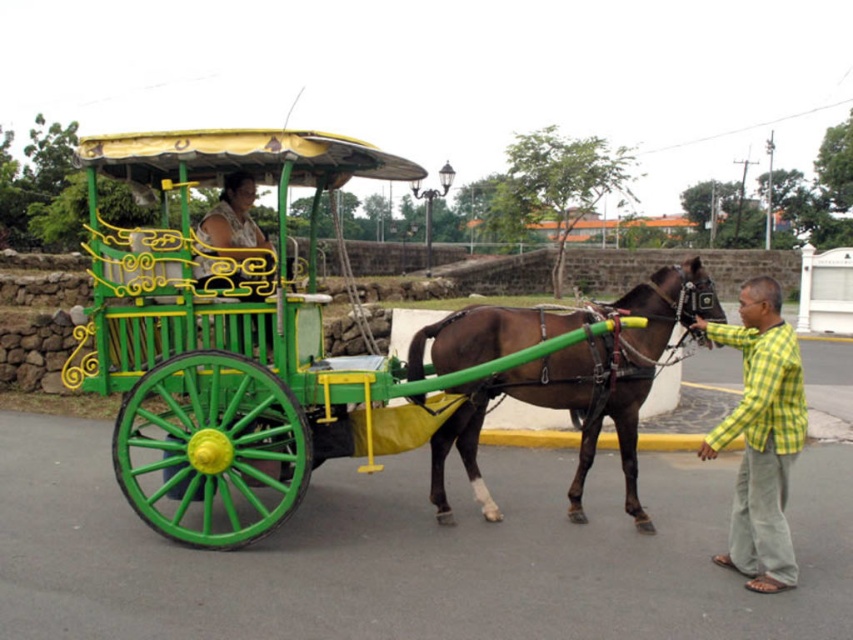
Question: Which point appears farthest from the camera in this image?

Choices:
 (A) (575, 372)
 (B) (596, 417)

Answer: (B)

Question: Among these objects, which one is farthest from the camera?

Choices:
 (A) green polished wood horse cart at center
 (B) brown glossy horse at center
 (C) yellow-green checkered shirt at lower right

Answer: (B)

Question: Is brown glossy horse at center below yellow-green checkered shirt at lower right?

Choices:
 (A) yes
 (B) no

Answer: (B)

Question: Which of the following is the farthest from the observer?

Choices:
 (A) (749, 440)
 (B) (650, 524)

Answer: (B)

Question: In this image, where is brown glossy horse at center located relative to yellow-green checkered shirt at lower right?

Choices:
 (A) above
 (B) below

Answer: (A)

Question: Considering the relative positions of brown glossy horse at center and yellow-green checkered shirt at lower right in the image provided, where is brown glossy horse at center located with respect to yellow-green checkered shirt at lower right?

Choices:
 (A) left
 (B) right

Answer: (A)